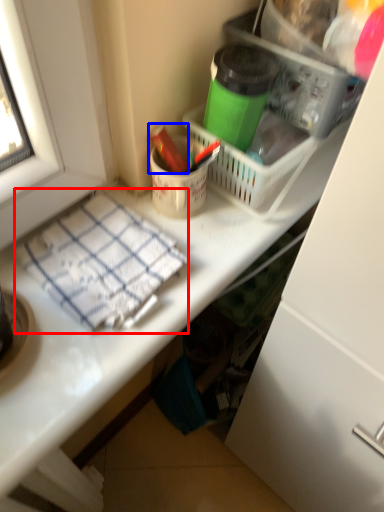
Question: Which object is further to the camera taking this photo, blanket (highlighted by a red box) or crayon (highlighted by a blue box)?

Choices:
 (A) blanket
 (B) crayon

Answer: (B)